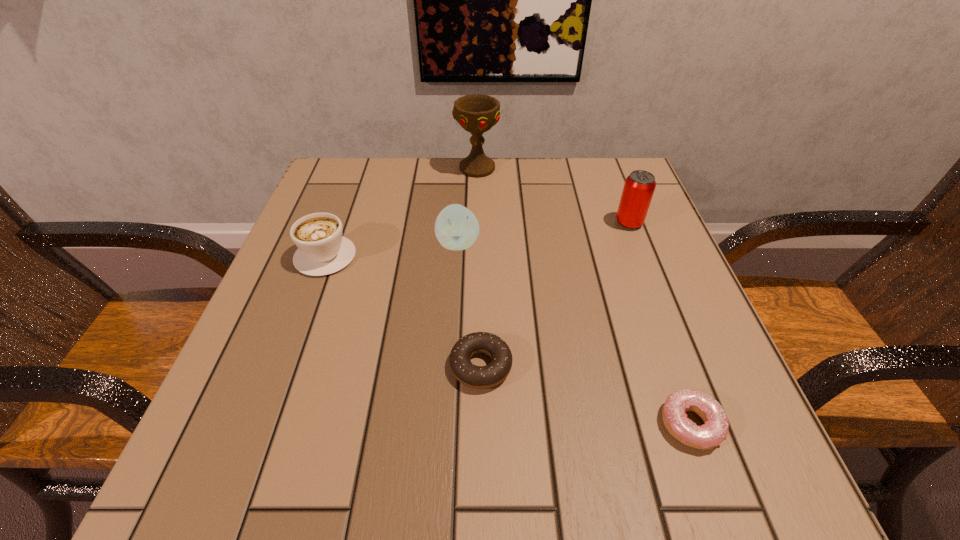
Locate an element on the screen. The height and width of the screenshot is (540, 960). chalice is located at coordinates (476, 113).

Find the location of a particular element. the tallest object is located at coordinates (476, 113).

Locate an element on the screen. The image size is (960, 540). the second tallest object is located at coordinates (639, 187).

The image size is (960, 540). What are the coordinates of `apple` in the screenshot? It's located at (456, 228).

The height and width of the screenshot is (540, 960). Identify the location of cappuccino. (322, 250).

Identify the location of the third shortest object. (322, 250).

You are a GUI agent. You are given a task and a screenshot of the screen. Output one action in this format:
    pyautogui.click(x=<x>, y=<y>)
    Task: Click on the left doughnut
    The height and width of the screenshot is (540, 960).
    Given the screenshot: What is the action you would take?
    pyautogui.click(x=478, y=377)

Locate an element on the screen. the fifth farthest object is located at coordinates (478, 377).

At what (x,y) coordinates should I click in order to perform the action: click on the right doughnut. Please return your answer as a coordinate pair (x, y). The width and height of the screenshot is (960, 540). Looking at the image, I should click on (714, 430).

Where is `the nearest object`? The width and height of the screenshot is (960, 540). the nearest object is located at coordinates (714, 430).